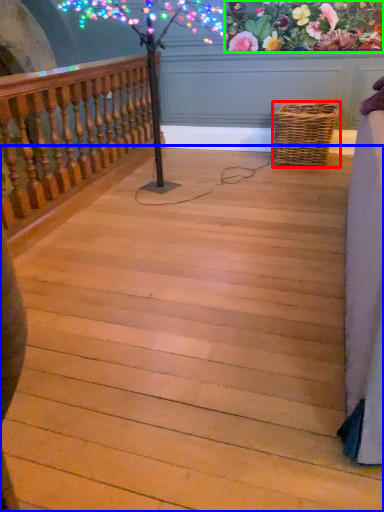
Question: Which is farther away from picnic basket (highlighted by a red box)? stairs (highlighted by a blue box) or floral arrangement (highlighted by a green box)?

Choices:
 (A) stairs
 (B) floral arrangement

Answer: (A)